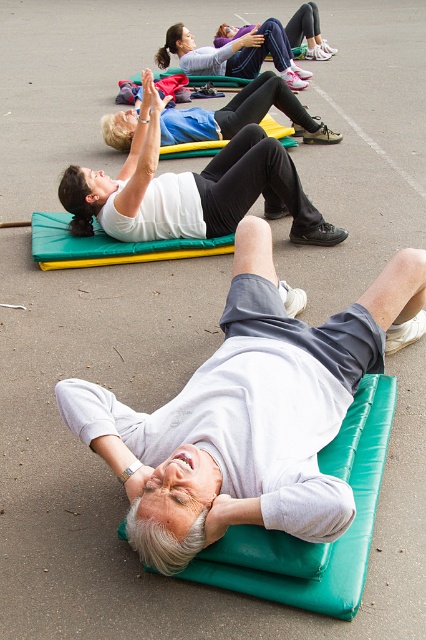
Between matte white shirt at upper center and matte purple leggings at upper center, which one has more height?

With more height is matte white shirt at upper center.

In the scene shown: Who is positioned more to the left, matte white shirt at upper center or matte purple leggings at upper center?

matte white shirt at upper center

This screenshot has height=640, width=426. I want to click on matte white shirt at upper center, so click(x=195, y=186).

Can you confirm if gray fabric mat at lower center is wider than matte white shirt at upper center?

No, gray fabric mat at lower center is not wider than matte white shirt at upper center.

Is gray fabric mat at lower center positioned before matte white shirt at upper center?

Yes, it is.

Where is `gray fabric mat at lower center`? The height and width of the screenshot is (640, 426). gray fabric mat at lower center is located at coordinates (249, 412).

This screenshot has width=426, height=640. Identify the location of gray fabric mat at lower center. (249, 412).

Can you confirm if gray fabric mat at lower center is positioned above teal leather yoga mat at lower center?

Correct, gray fabric mat at lower center is located above teal leather yoga mat at lower center.

Is gray fabric mat at lower center further to the viewer compared to teal leather yoga mat at lower center?

No.

Between point (321, 406) and point (353, 420), which one is positioned behind?

Point (353, 420)

At what (x,y) coordinates should I click in order to perform the action: click on gray fabric mat at lower center. Please return your answer as a coordinate pair (x, y). The image size is (426, 640). Looking at the image, I should click on (249, 412).